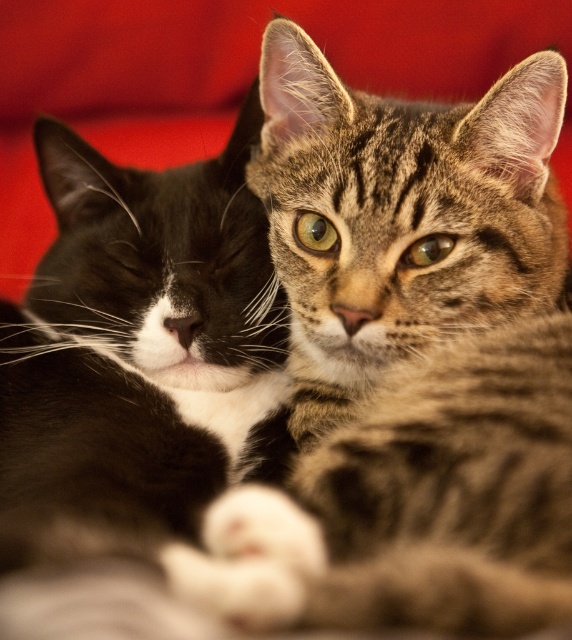
Is tabby fur cat at center to the left of soft fur cat at center from the viewer's perspective?

No, tabby fur cat at center is not to the left of soft fur cat at center.

Identify the location of tabby fur cat at center. (407, 362).

Who is more distant from viewer, (522, 460) or (80, 154)?

Point (80, 154)

You are a GUI agent. You are given a task and a screenshot of the screen. Output one action in this format:
    pyautogui.click(x=<x>, y=<y>)
    Task: Click on the tabby fur cat at center
    
    Given the screenshot: What is the action you would take?
    pyautogui.click(x=407, y=362)